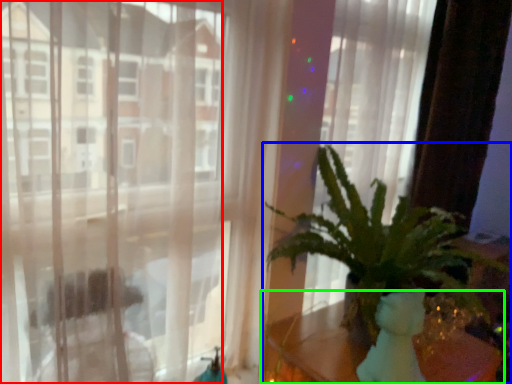
Question: Based on their relative distances, which object is farther from window (highlighted by a red box)? Choose from houseplant (highlighted by a blue box) and table (highlighted by a green box).

Choices:
 (A) houseplant
 (B) table

Answer: (B)